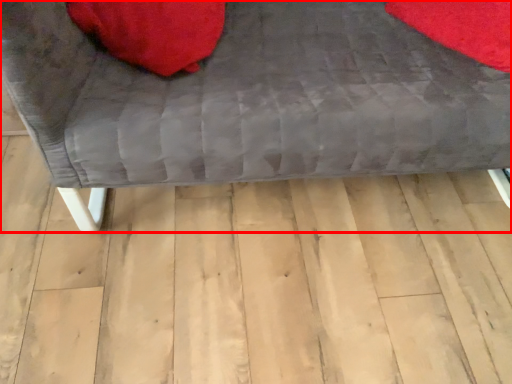
Question: From the image's perspective, what is the correct spatial positioning of furniture (annotated by the red box) in reference to bean bag chair?

Choices:
 (A) below
 (B) above

Answer: (A)